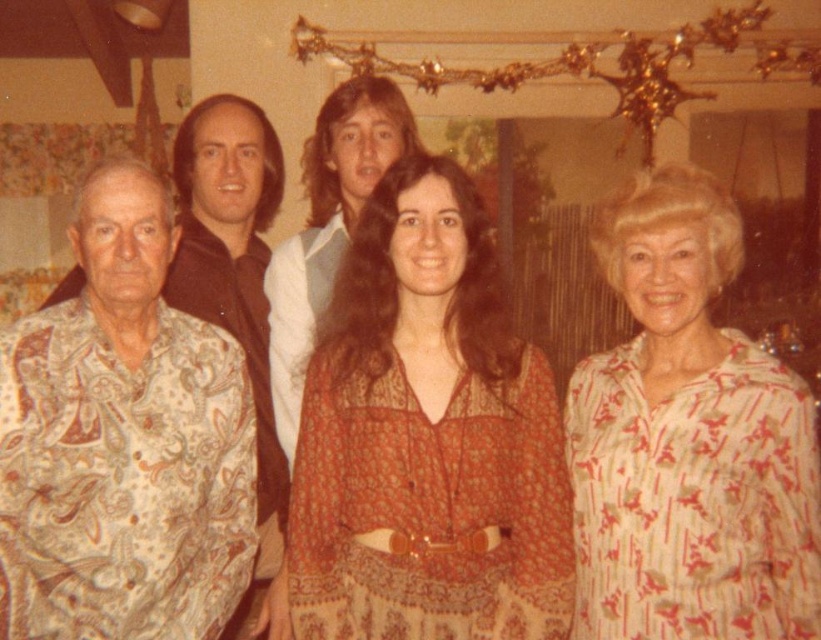
Consider the image. You are a photographer holding a camera. You want to take a photo of the patterned fabric shirt at left. Can you reach it with your 2.5 meter long extension pole?

The distance between the camera and the patterned fabric shirt at left is 2.69 meters. Since the extension pole is only 2.5 meters long, you cannot reach it.

The point at coordinates (232, 266) is located on which person? Please specify the person by their description.

→ The point at coordinates (232, 266) is on the patterned fabric shirt of the older man at the far left.